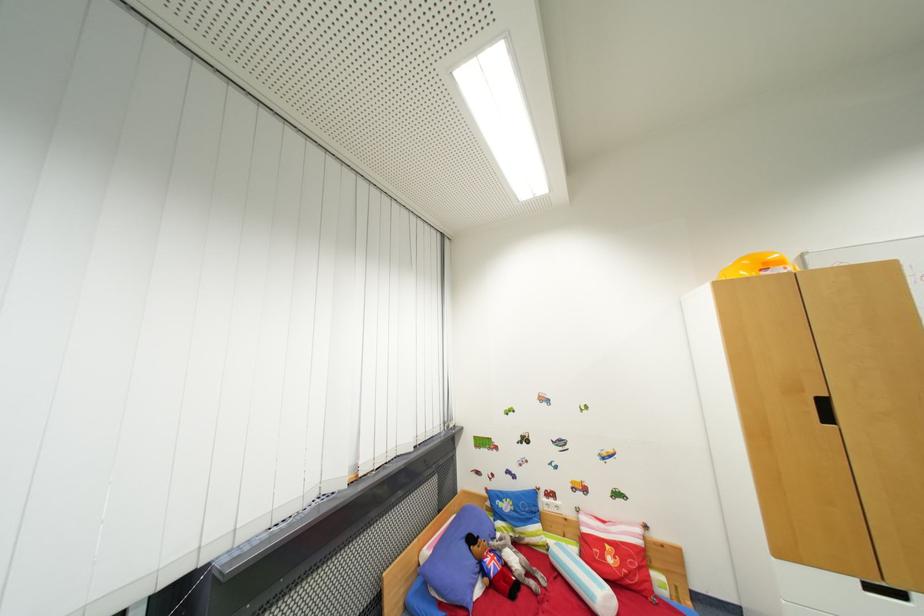
Locate an element on the screen. The width and height of the screenshot is (924, 616). stuffed guard doll is located at coordinates coord(504,564).